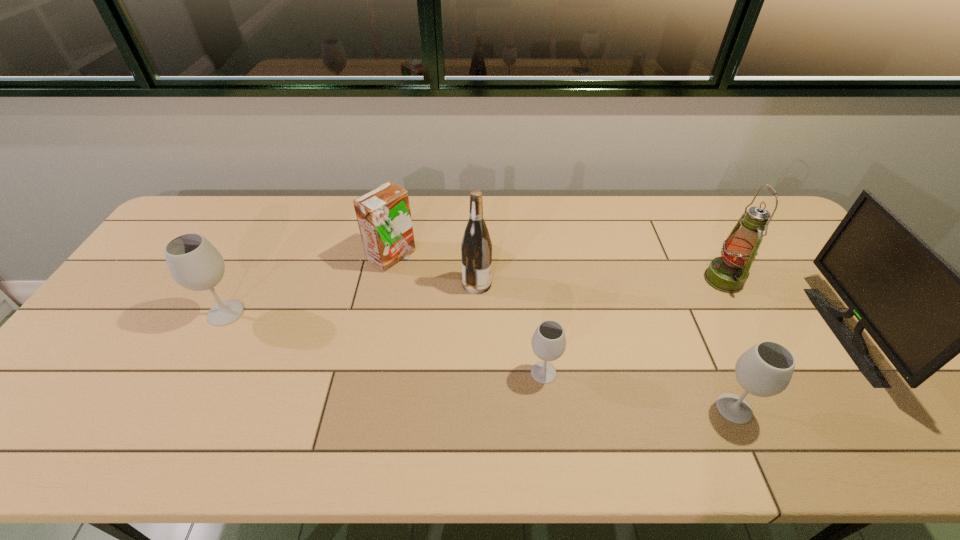
At what (x,y) coordinates should I click in order to perform the action: click on vacant position in the image that satisfies the following two spatial constraints: 1. on the back side of the oil lamp; 2. on the left side of the farthest wineglass. Please return your answer as a coordinate pair (x, y). Looking at the image, I should click on (244, 280).

Identify the location of free space that satisfies the following two spatial constraints: 1. on the front side of the fourth object from left to right; 2. on the right side of the wine bottle. (476, 373).

Identify the location of vacant region that satisfies the following two spatial constraints: 1. on the straw side of the carton; 2. on the left side of the rightmost wineglass. This screenshot has height=540, width=960. (360, 408).